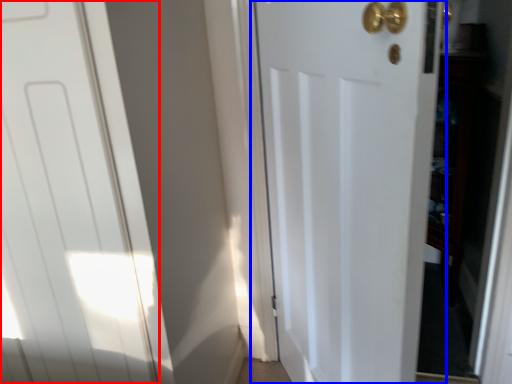
Question: Which object appears closest to the camera in this image, door (highlighted by a red box) or door (highlighted by a blue box)?

Choices:
 (A) door
 (B) door

Answer: (B)